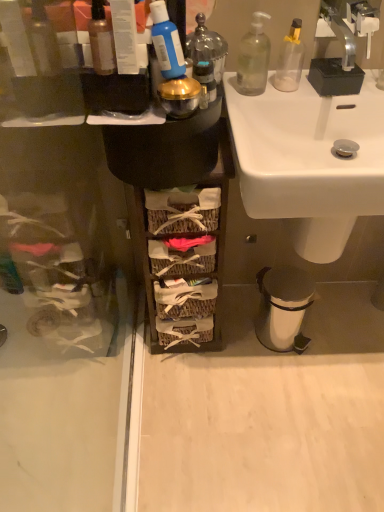
Question: From a real-world perspective, is clear glass bottle at upper right, acting as the 2th bottle starting from the left, positioned above or below transparent plastic bottle at upper right, the 3th bottle in the front-to-back sequence?

Choices:
 (A) above
 (B) below

Answer: (A)

Question: Looking at the image, does clear glass bottle at upper right, the 2th bottle viewed from the back, seem bigger or smaller compared to transparent plastic bottle at upper right, which is counted as the first bottle, starting from the back?

Choices:
 (A) small
 (B) big

Answer: (B)

Question: Based on their relative distances, which object is farther from the white ceramic sink at center?

Choices:
 (A) translucent glass bottle at upper left, placed as the first bottle when sorted from left to right
 (B) silver metallic trash can at lower right
 (C) woven wood baskets at center
 (D) silver metallic faucet at upper right
 (E) shiny metallic container at upper center, arranged as the first toiletry when viewed from the back

Answer: (A)

Question: Estimate the real-world distances between objects in this image. Which object is closer to the shiny metallic container at upper center, arranged as the first toiletry when viewed from the back?

Choices:
 (A) blue matte toothpaste tube at upper center, the 2th toiletry from the back
 (B) transparent plastic screen door at left
 (C) clear glass bottle at upper right, acting as the 2th bottle starting from the left
 (D) transparent plastic bottle at upper right, the 1th bottle positioned from the right
 (E) translucent glass bottle at upper left, marked as the third bottle in a right-to-left arrangement

Answer: (C)